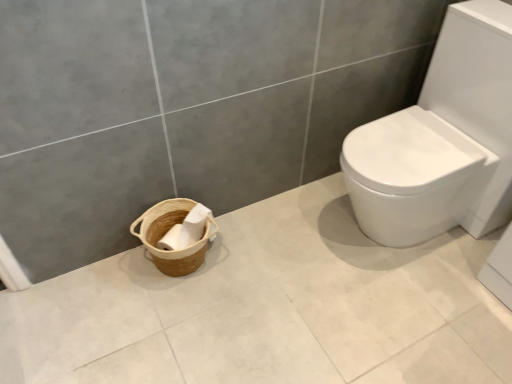
Measure the distance between point (139,225) and camera.

A: Point (139,225) is 5.28 feet away from camera.

What do you see at coordinates (167, 231) in the screenshot? The height and width of the screenshot is (384, 512). I see `braided wood basket at lower left` at bounding box center [167, 231].

At what (x,y) coordinates should I click in order to perform the action: click on braided wood basket at lower left. Please return your answer as a coordinate pair (x, y). This screenshot has width=512, height=384. Looking at the image, I should click on (167, 231).

Where is `braided wood basket at lower left`? braided wood basket at lower left is located at coordinates (167, 231).